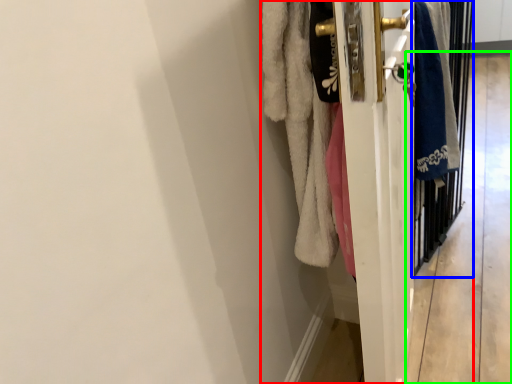
Question: Estimate the real-world distances between objects in this image. Which object is farther from closet (highlighted by a red box), screen door (highlighted by a blue box) or corridor (highlighted by a green box)?

Choices:
 (A) screen door
 (B) corridor

Answer: (B)